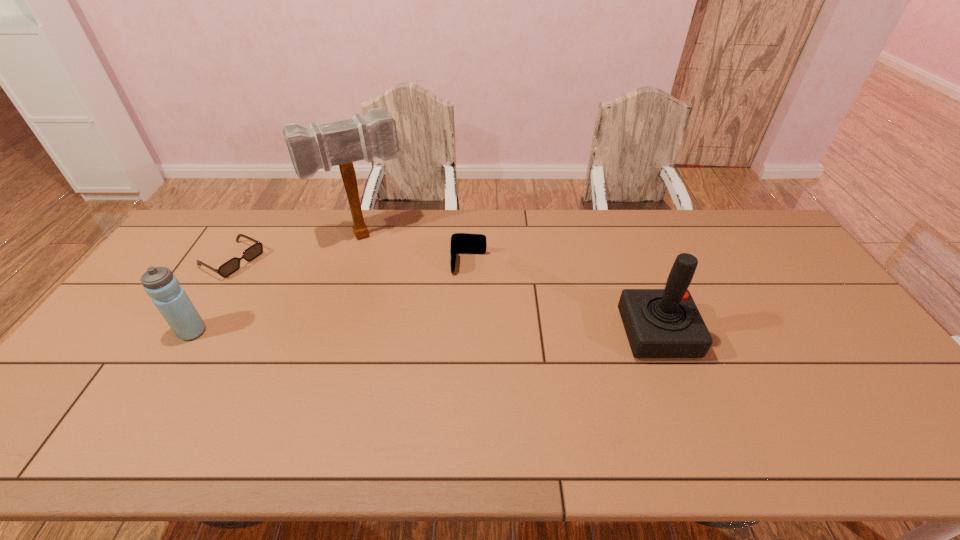
At what (x,y) coordinates should I click in order to perform the action: click on object at the left edge. Please return your answer as a coordinate pair (x, y). Looking at the image, I should click on (231, 266).

Image resolution: width=960 pixels, height=540 pixels. In order to click on object present at the far left corner in this screenshot , I will do `click(231, 266)`.

Identify the location of free region at the far edge of the desktop. The image size is (960, 540). coord(709,212).

Where is `free location at the near edge`? The width and height of the screenshot is (960, 540). free location at the near edge is located at coordinates (755, 389).

Locate an element on the screen. Image resolution: width=960 pixels, height=540 pixels. vacant region at the left edge of the desktop is located at coordinates (156, 329).

Find the location of a particular element. The width and height of the screenshot is (960, 540). vacant space at the far left corner of the desktop is located at coordinates (223, 233).

The width and height of the screenshot is (960, 540). Identify the location of free space at the near right corner of the desktop. (892, 402).

You are a GUI agent. You are given a task and a screenshot of the screen. Output one action in this format:
    pyautogui.click(x=<x>, y=<y>)
    Task: Click on the free space that is in between the joystick and the shortest object
    
    Given the screenshot: What is the action you would take?
    pyautogui.click(x=444, y=297)

The image size is (960, 540). I want to click on free area in between the shortest object and the wallet, so click(x=350, y=262).

Locate an element on the screen. The height and width of the screenshot is (540, 960). vacant space in between the joystick and the shortest object is located at coordinates (444, 297).